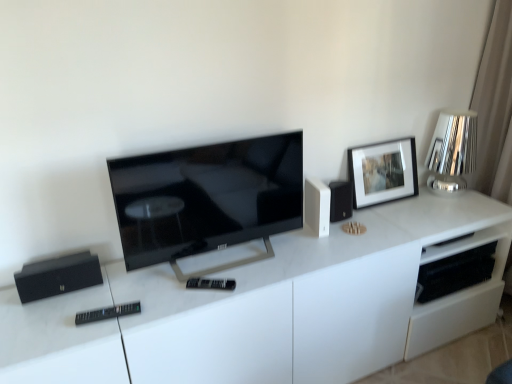
Where is `vacant space to the right of black matte speaker at left`? Image resolution: width=512 pixels, height=384 pixels. vacant space to the right of black matte speaker at left is located at coordinates 118,289.